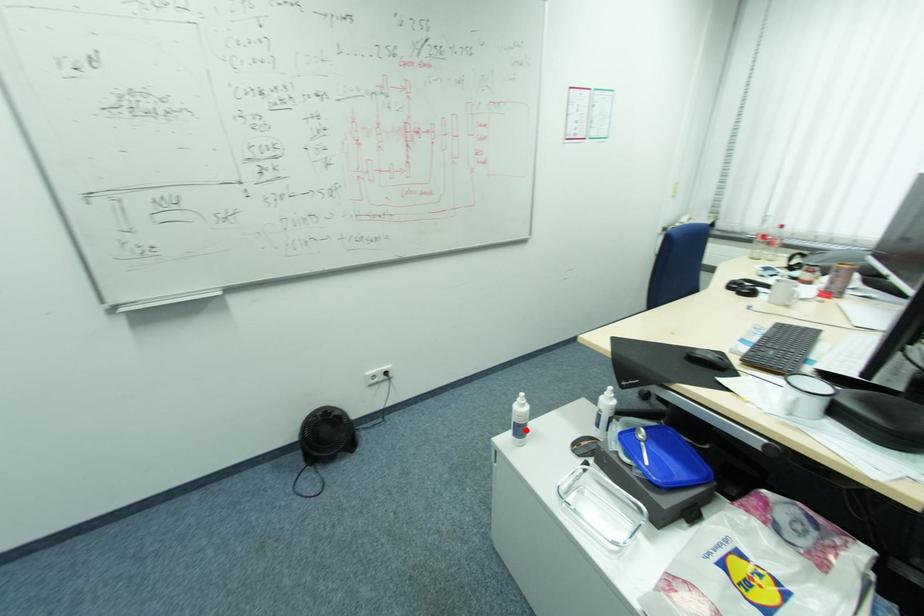
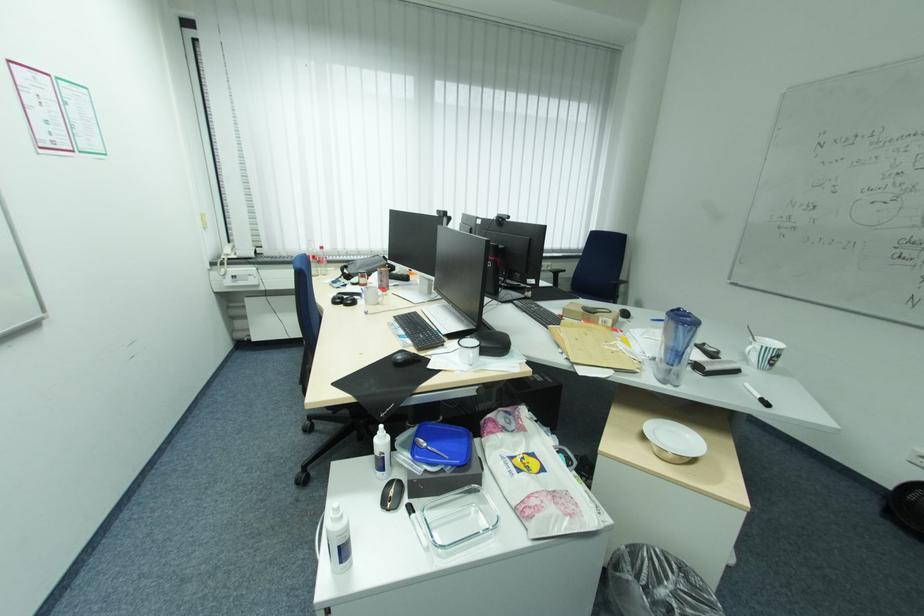
Where in the second image is the point corresponding to the highlighted location from the first image?

(350, 549)